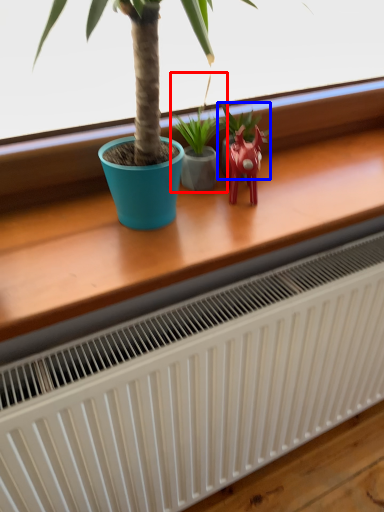
Question: Which of the following is the closest to the observer, houseplant (highlighted by a red box) or houseplant (highlighted by a blue box)?

Choices:
 (A) houseplant
 (B) houseplant

Answer: (A)